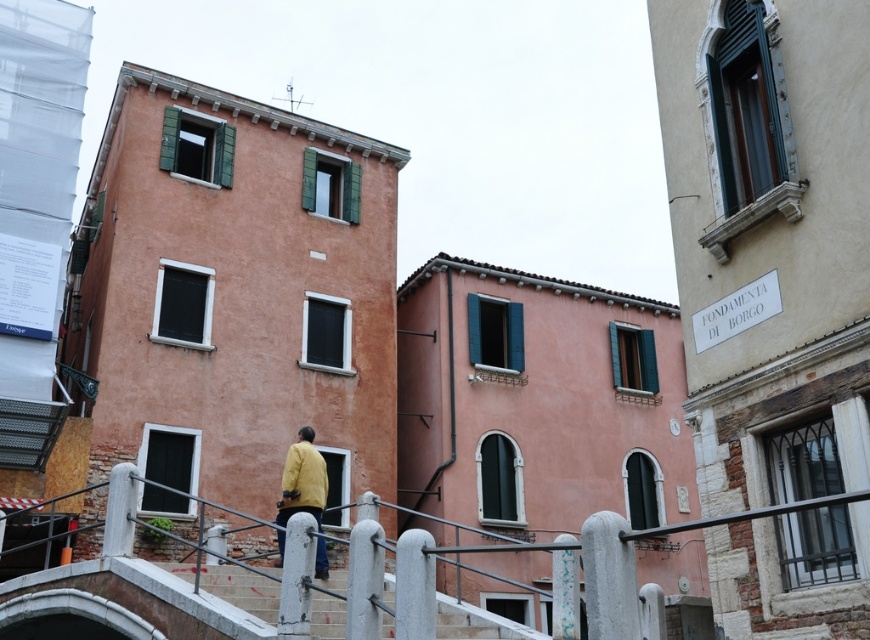
Question: Is concrete stairs at lower center to the right of yellow matte jacket at center from the viewer's perspective?

Choices:
 (A) no
 (B) yes

Answer: (B)

Question: Which point appears closest to the camera in this image?

Choices:
 (A) (311, 484)
 (B) (589, 556)

Answer: (B)

Question: Which of the following is the farthest from the observer?

Choices:
 (A) yellow matte jacket at center
 (B) white metal railing at lower center

Answer: (A)

Question: Can you confirm if white metal railing at lower center is positioned below yellow matte jacket at center?

Choices:
 (A) yes
 (B) no

Answer: (B)

Question: Among these points, which one is nearest to the camera?

Choices:
 (A) (303, 433)
 (B) (236, 588)
 (C) (351, 598)

Answer: (C)

Question: Does white metal railing at lower center have a smaller size compared to concrete stairs at lower center?

Choices:
 (A) yes
 (B) no

Answer: (B)